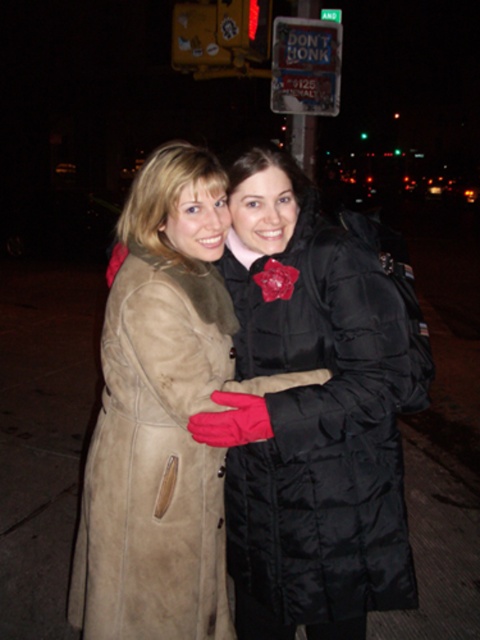
Question: Can you confirm if suede coat at center is thinner than velvet black coat at center?

Choices:
 (A) yes
 (B) no

Answer: (B)

Question: Can you confirm if suede coat at left is positioned to the left of velvet black coat at center?

Choices:
 (A) no
 (B) yes

Answer: (B)

Question: Which object is farther from the camera taking this photo?

Choices:
 (A) metallic blue sign at upper center
 (B) velvet black coat at center

Answer: (A)

Question: Which point is closer to the camera?

Choices:
 (A) velvet black coat at center
 (B) suede coat at center

Answer: (B)

Question: Which object is farther from the camera taking this photo?

Choices:
 (A) velvet black coat at center
 (B) metallic blue sign at upper center

Answer: (B)

Question: Can you confirm if suede coat at left is smaller than metallic blue sign at upper center?

Choices:
 (A) no
 (B) yes

Answer: (A)